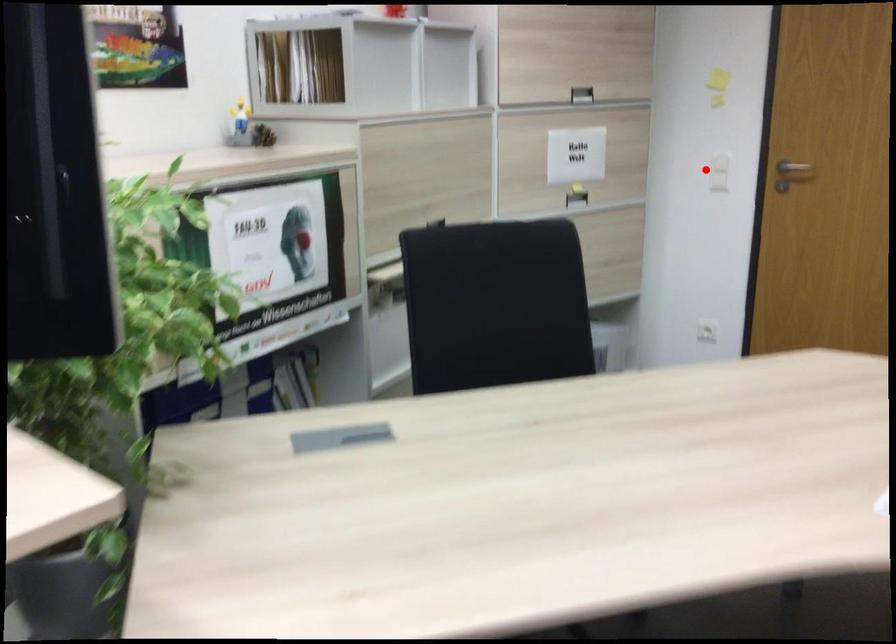
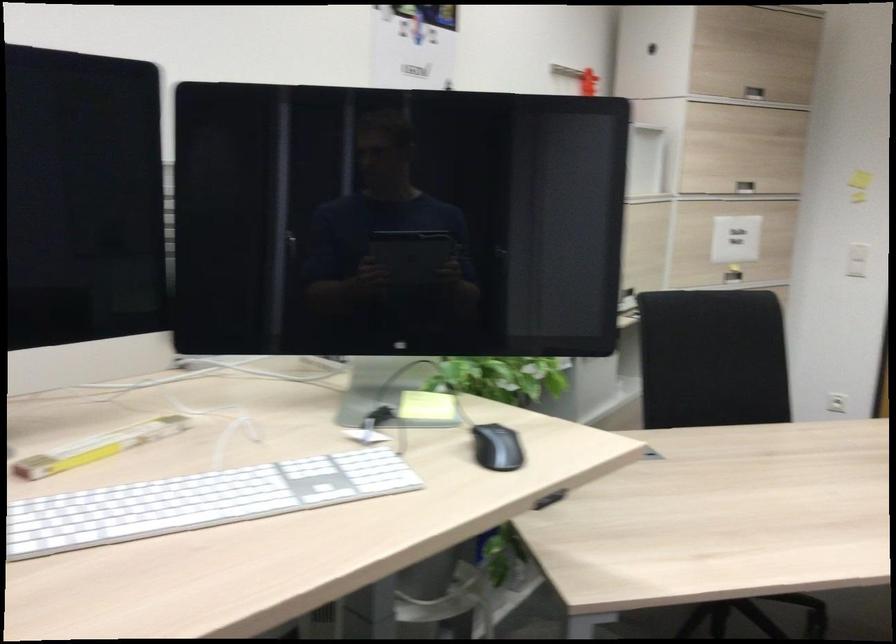
In the second image, find the point that corresponds to the highlighted location in the first image.

(857, 260)